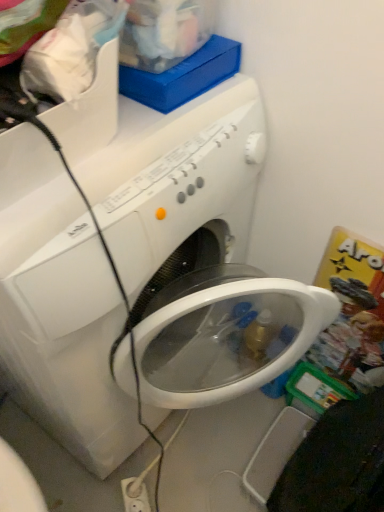
Question: In terms of height, does white plastic electric outlet at lower center look taller or shorter compared to white glossy washing machine at center?

Choices:
 (A) tall
 (B) short

Answer: (B)

Question: Considering the relative positions of white plastic electric outlet at lower center and white glossy washing machine at center in the image provided, is white plastic electric outlet at lower center to the left or to the right of white glossy washing machine at center?

Choices:
 (A) left
 (B) right

Answer: (B)

Question: From the image's perspective, is white plastic electric outlet at lower center above or below white glossy washing machine at center?

Choices:
 (A) below
 (B) above

Answer: (A)

Question: Is white glossy washing machine at center taller or shorter than white plastic electric outlet at lower center?

Choices:
 (A) short
 (B) tall

Answer: (B)

Question: Considering their positions, is white glossy washing machine at center located in front of or behind white plastic electric outlet at lower center?

Choices:
 (A) behind
 (B) front

Answer: (B)

Question: From the image's perspective, is white glossy washing machine at center located above or below white plastic electric outlet at lower center?

Choices:
 (A) above
 (B) below

Answer: (A)

Question: Considering the positions of white glossy washing machine at center and white plastic electric outlet at lower center in the image, is white glossy washing machine at center wider or thinner than white plastic electric outlet at lower center?

Choices:
 (A) wide
 (B) thin

Answer: (A)